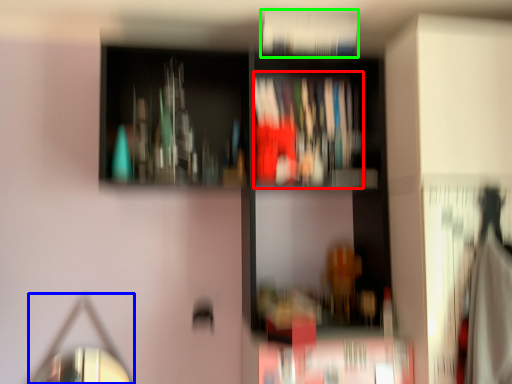
Question: Which is farther away from book (highlighted by a red box)? mirror (highlighted by a blue box) or book (highlighted by a green box)?

Choices:
 (A) mirror
 (B) book

Answer: (A)